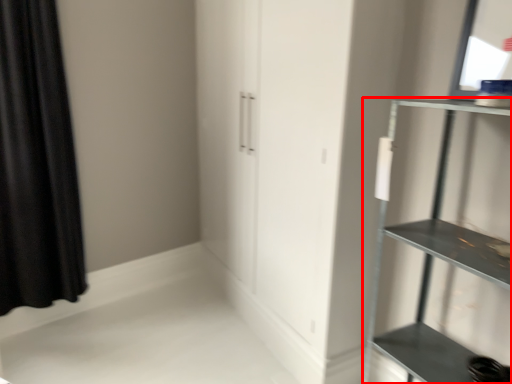
Question: From the image's perspective, what is the correct spatial relationship of shelf (annotated by the red box) in relation to curtain?

Choices:
 (A) above
 (B) below

Answer: (B)